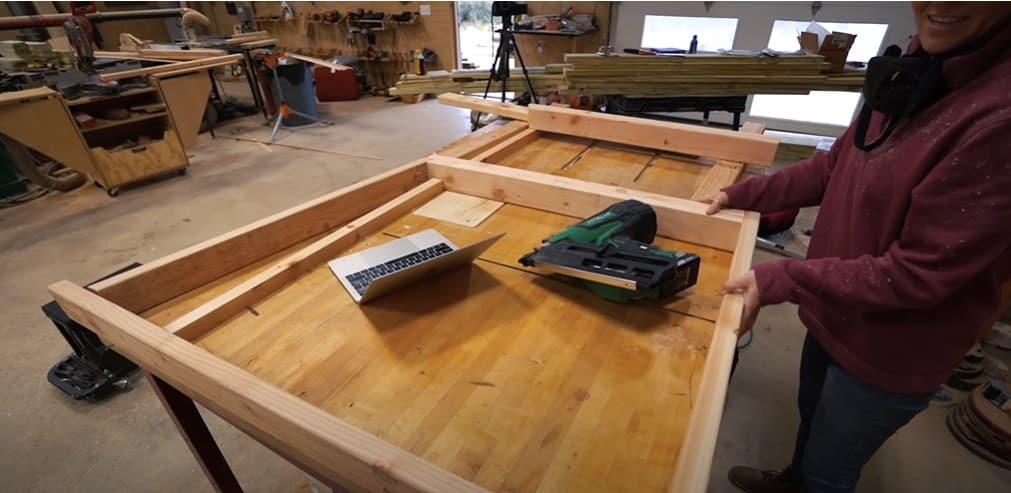
This screenshot has width=1011, height=493. I want to click on laptop, so click(403, 277).